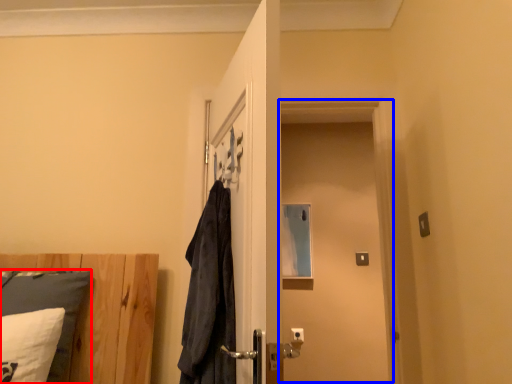
Question: Which object is further to the camera taking this photo, pillow (highlighted by a red box) or screen door (highlighted by a blue box)?

Choices:
 (A) pillow
 (B) screen door

Answer: (B)